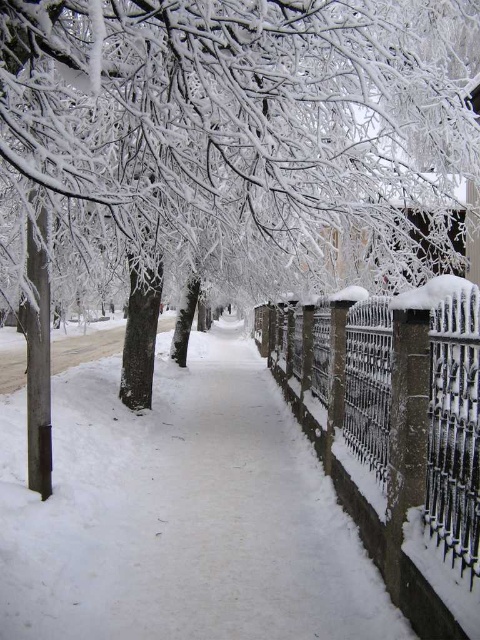
Who is more forward, (269, 563) or (476, 307)?

Positioned in front is point (476, 307).

Where is `white snow pavement at center`? white snow pavement at center is located at coordinates (180, 513).